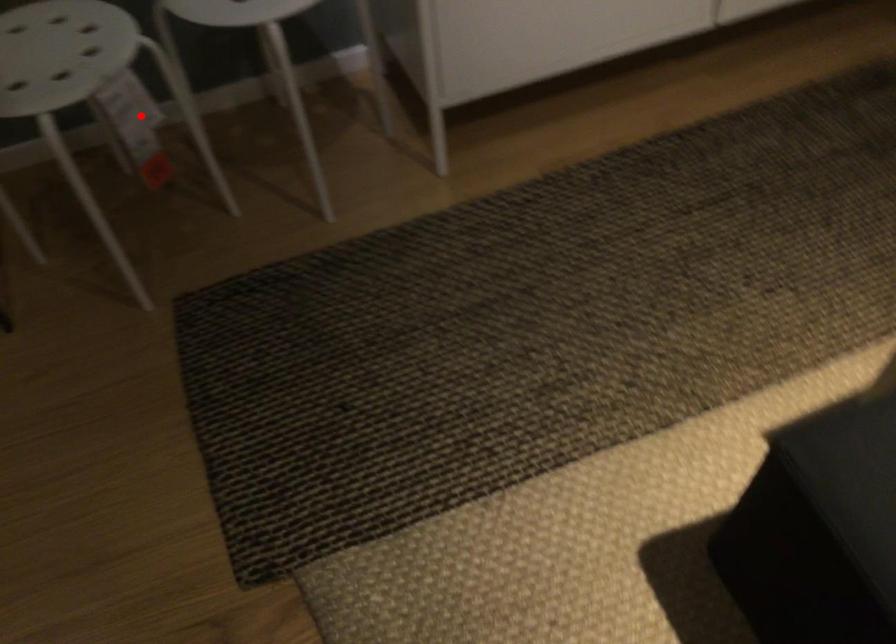
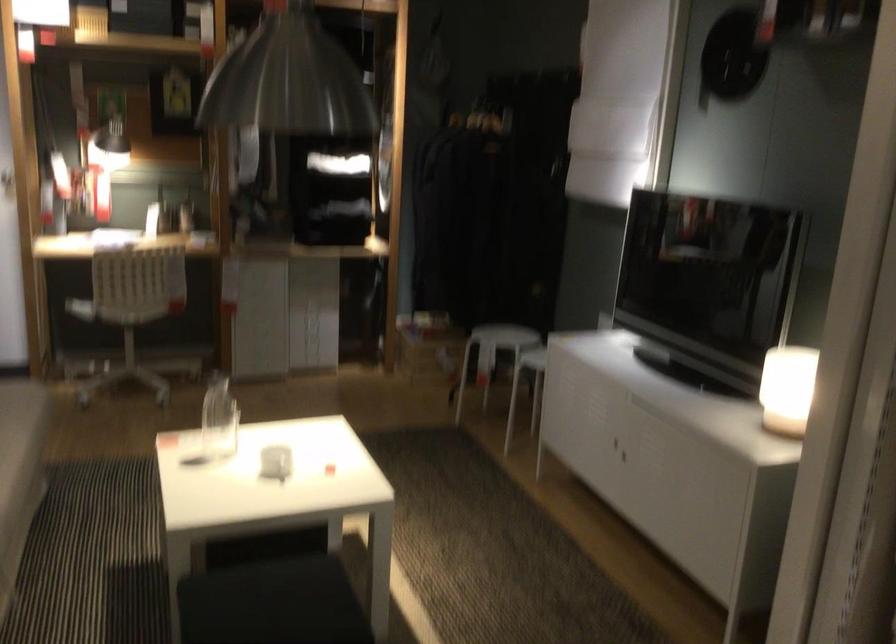
Question: I am providing you with two images of the same scene from different viewpoints. Image1 has a red point marked. In image2, the corresponding 3D location appears at what relative position? Reply with the corresponding letter.

Choices:
 (A) Closer
 (B) Farther

Answer: (B)